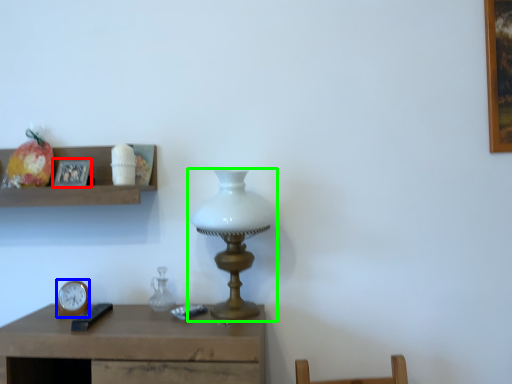
Question: Which object is positioned closest to picture frame (highlighted by a red box)? Select from clock (highlighted by a blue box) and lamp (highlighted by a green box).

Choices:
 (A) clock
 (B) lamp

Answer: (A)